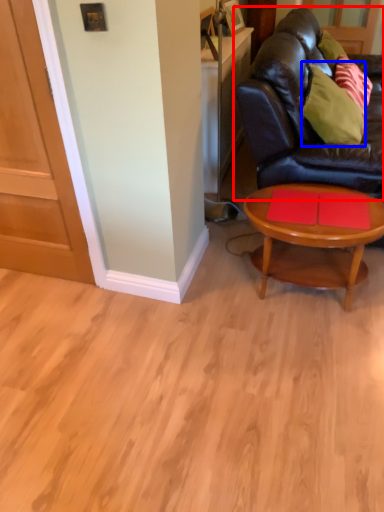
Question: Which of the following is the farthest to the observer, studio couch (highlighted by a red box) or pillow (highlighted by a blue box)?

Choices:
 (A) studio couch
 (B) pillow

Answer: (B)